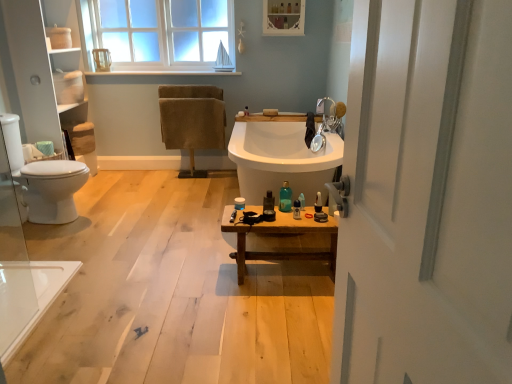
I want to click on vacant region under wooden bench at center (from a real-world perspective), so click(286, 273).